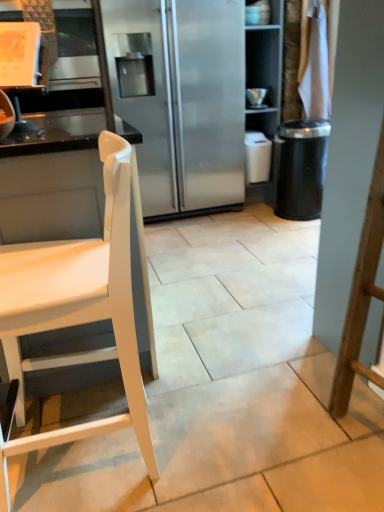
Question: Based on their positions, is white matte chair at left located to the left or right of black textured trash can at right?

Choices:
 (A) left
 (B) right

Answer: (A)

Question: Looking at the image, does white matte chair at left seem bigger or smaller compared to black textured trash can at right?

Choices:
 (A) small
 (B) big

Answer: (B)

Question: Considering the positions of point (110, 231) and point (279, 205), is point (110, 231) closer or farther from the camera than point (279, 205)?

Choices:
 (A) closer
 (B) farther

Answer: (A)

Question: Relative to white matte chair at left, is black textured trash can at right in front or behind?

Choices:
 (A) behind
 (B) front

Answer: (A)

Question: In terms of width, does black textured trash can at right look wider or thinner when compared to white matte chair at left?

Choices:
 (A) thin
 (B) wide

Answer: (A)

Question: Is point (317, 139) closer or farther from the camera than point (92, 312)?

Choices:
 (A) closer
 (B) farther

Answer: (B)

Question: Is black textured trash can at right inside the boundaries of white matte chair at left, or outside?

Choices:
 (A) outside
 (B) inside

Answer: (A)